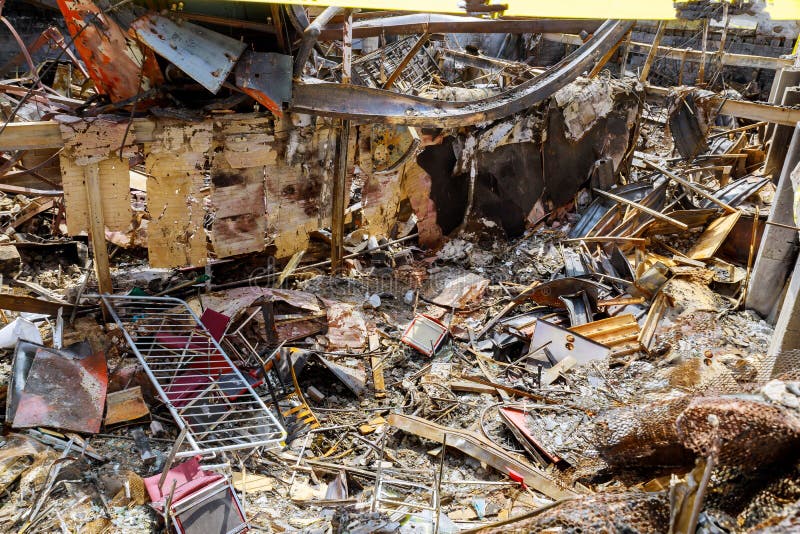
The width and height of the screenshot is (800, 534). I want to click on old carpet, so click(758, 428).